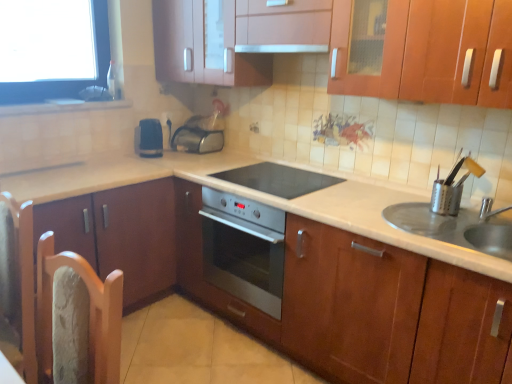
Question: Is black glass cooktop at center taller than metallic silver outlet at center?

Choices:
 (A) no
 (B) yes

Answer: (A)

Question: Does black glass cooktop at center have a lesser width compared to metallic silver outlet at center?

Choices:
 (A) yes
 (B) no

Answer: (B)

Question: From the image's perspective, is black glass cooktop at center above metallic silver outlet at center?

Choices:
 (A) no
 (B) yes

Answer: (A)

Question: From a real-world perspective, is black glass cooktop at center below metallic silver outlet at center?

Choices:
 (A) no
 (B) yes

Answer: (B)

Question: Can you confirm if black glass cooktop at center is wider than metallic silver outlet at center?

Choices:
 (A) no
 (B) yes

Answer: (B)

Question: Can you confirm if black glass cooktop at center is positioned to the right of metallic silver outlet at center?

Choices:
 (A) no
 (B) yes

Answer: (B)

Question: Is metallic silver toaster at center, acting as the second appliance starting from the left, positioned before wooden chair at left?

Choices:
 (A) no
 (B) yes

Answer: (A)

Question: Is wooden chair at left located within metallic silver toaster at center, which is the first appliance from top to bottom?

Choices:
 (A) no
 (B) yes

Answer: (A)

Question: From the image's perspective, is metallic silver toaster at center, which is the 3th appliance from bottom to top, below wooden chair at left?

Choices:
 (A) no
 (B) yes

Answer: (A)

Question: Can you confirm if metallic silver toaster at center, which is the 3th appliance from bottom to top, is bigger than wooden chair at left?

Choices:
 (A) no
 (B) yes

Answer: (A)

Question: Does metallic silver toaster at center, which is the first appliance from top to bottom, have a lesser width compared to wooden chair at left?

Choices:
 (A) yes
 (B) no

Answer: (B)

Question: Is wooden chair at left at the back of metallic silver toaster at center, which is the first appliance from top to bottom?

Choices:
 (A) no
 (B) yes

Answer: (A)

Question: Can metallic silver outlet at center be found inside white glossy countertop at center?

Choices:
 (A) no
 (B) yes

Answer: (A)